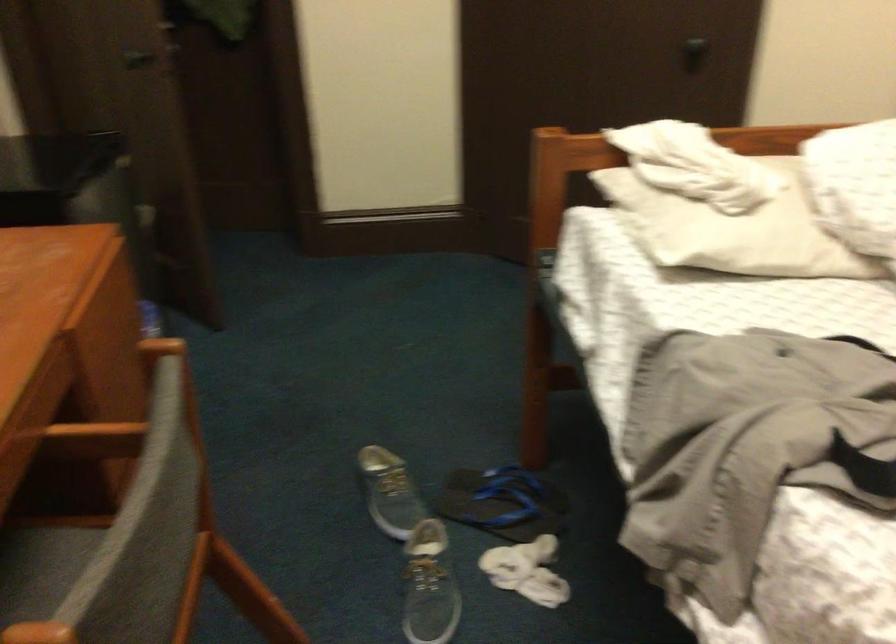
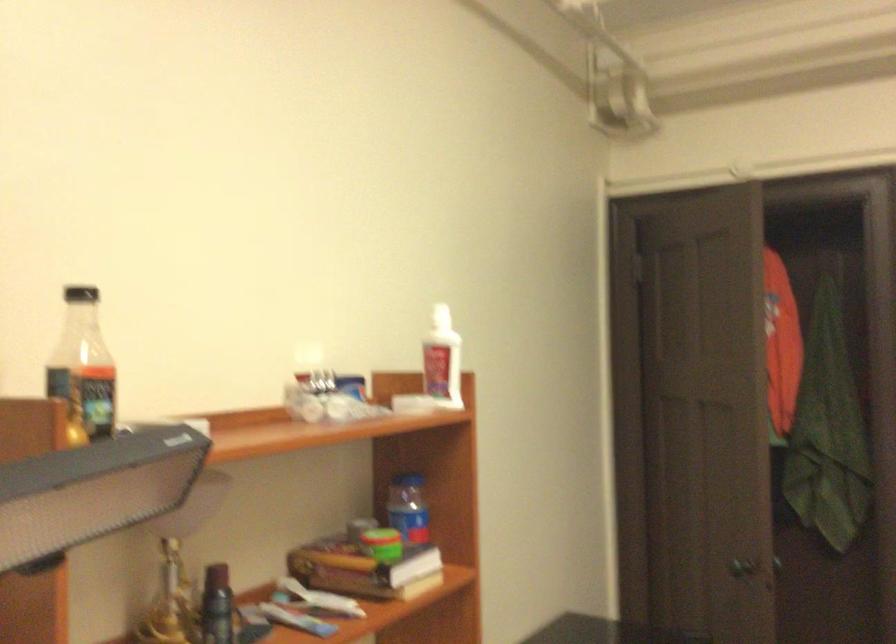
How did the camera likely rotate?

The camera rotated toward left-up.